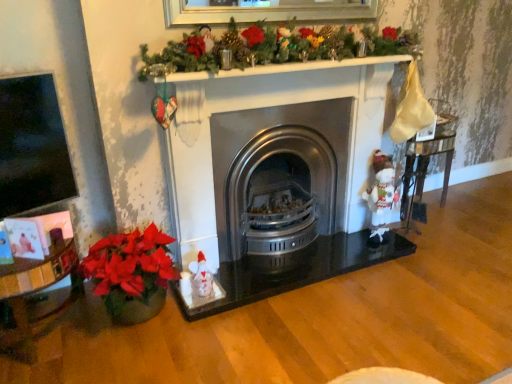
At what (x,y) coordinates should I click in order to perform the action: click on stainless steel wood burning stove at center. Please return your answer as a coordinate pair (x, y). Image resolution: width=512 pixels, height=384 pixels. Looking at the image, I should click on (279, 178).

You are a GUI agent. You are given a task and a screenshot of the screen. Output one action in this format:
    pyautogui.click(x=<x>, y=<y>)
    Task: Click on the wooden glossy table at right
    
    Given the screenshot: What is the action you would take?
    pyautogui.click(x=426, y=169)

The image size is (512, 384). I want to click on stainless steel wood burning stove at center, so click(x=279, y=178).

Do you think stainless steel wood burning stove at center is within white plush santa at right, or outside of it?

stainless steel wood burning stove at center cannot be found inside white plush santa at right.

Considering the relative sizes of stainless steel wood burning stove at center and white plush santa at right in the image provided, is stainless steel wood burning stove at center thinner than white plush santa at right?

No, stainless steel wood burning stove at center is not thinner than white plush santa at right.

Between point (313, 231) and point (374, 155), which one is positioned in front?

The point (374, 155) is closer to the camera.

Is stainless steel wood burning stove at center to the left or to the right of white plush santa at right in the image?

From the image, it's evident that stainless steel wood burning stove at center is to the left of white plush santa at right.

Does white plush santa at right have a greater width compared to stainless steel wood burning stove at center?

Incorrect, the width of white plush santa at right does not surpass that of stainless steel wood burning stove at center.

Can you confirm if white plush santa at right is positioned to the left of stainless steel wood burning stove at center?

In fact, white plush santa at right is to the right of stainless steel wood burning stove at center.

Is white plush santa at right positioned beyond the bounds of stainless steel wood burning stove at center?

Yes.

Considering the points (387, 158) and (269, 247), which point is behind, point (387, 158) or point (269, 247)?

The point (387, 158) is behind.

Between point (443, 139) and point (262, 237), which one is positioned in front?

The point (262, 237) is closer to the camera.

How different are the orientations of wooden glossy table at right and stainless steel wood burning stove at center in degrees?

0.293 degrees separate the facing orientations of wooden glossy table at right and stainless steel wood burning stove at center.

Is wooden glossy table at right taller or shorter than stainless steel wood burning stove at center?

In the image, wooden glossy table at right appears to be shorter than stainless steel wood burning stove at center.

Considering the sizes of objects wooden glossy table at right and stainless steel wood burning stove at center in the image provided, who is bigger, wooden glossy table at right or stainless steel wood burning stove at center?

Result: Bigger between the two is stainless steel wood burning stove at center.

Is point (292, 190) behind point (424, 206)?

No, it is not.

From a real-world perspective, is stainless steel wood burning stove at center physically located above or below wooden glossy table at right?

From a real-world perspective, stainless steel wood burning stove at center is physically above wooden glossy table at right.

Does stainless steel wood burning stove at center have a lesser width compared to wooden glossy table at right?

In fact, stainless steel wood burning stove at center might be wider than wooden glossy table at right.

Is stainless steel wood burning stove at center beside wooden glossy table at right?

No, stainless steel wood burning stove at center is not with wooden glossy table at right.

Locate an element on the screen. This screenshot has height=384, width=512. santa claus in front of the wooden glossy table at right is located at coordinates (380, 195).

In the image, is white plush santa at right positioned in front of or behind wooden glossy table at right?

white plush santa at right is in front of wooden glossy table at right.

From the image's perspective, would you say white plush santa at right is positioned over wooden glossy table at right?

No, from the image's perspective, white plush santa at right is not above wooden glossy table at right.

Is white plush santa at right aimed at wooden glossy table at right?

No, white plush santa at right is not aimed at wooden glossy table at right.

Is wooden glossy table at right next to white plush santa at right and touching it?

No, wooden glossy table at right is not in contact with white plush santa at right.

Does wooden glossy table at right have a greater width compared to white plush santa at right?

Yes, wooden glossy table at right is wider than white plush santa at right.

You are a GUI agent. You are given a task and a screenshot of the screen. Output one action in this format:
    pyautogui.click(x=<x>, y=<y>)
    Task: Click on the santa claus on the left side of wooden glossy table at right
    Image resolution: width=512 pixels, height=384 pixels.
    Given the screenshot: What is the action you would take?
    pyautogui.click(x=380, y=195)

You are a GUI agent. You are given a task and a screenshot of the screen. Output one action in this format:
    pyautogui.click(x=<x>, y=<y>)
    Task: Click on the wood burning stove in front of the white plush santa at right
    
    Given the screenshot: What is the action you would take?
    pyautogui.click(x=279, y=178)

Where is `santa claus below the stainless steel wood burning stove at center (from a real-world perspective)`? Image resolution: width=512 pixels, height=384 pixels. santa claus below the stainless steel wood burning stove at center (from a real-world perspective) is located at coordinates (380, 195).

Based on the photo, from the image, which object appears to be nearer to stainless steel wood burning stove at center, white plush santa at right or wooden glossy table at right?

The object closer to stainless steel wood burning stove at center is white plush santa at right.

From the picture: Which object lies further to the anchor point white plush santa at right, wooden glossy table at right or stainless steel wood burning stove at center?

Based on the image, stainless steel wood burning stove at center appears to be further to white plush santa at right.

When comparing their distances from wooden glossy table at right, does stainless steel wood burning stove at center or white plush santa at right seem closer?

white plush santa at right lies closer to wooden glossy table at right than the other object.

Consider the image. Based on their spatial positions, is stainless steel wood burning stove at center or wooden glossy table at right further from white plush santa at right?

stainless steel wood burning stove at center is positioned further to the anchor white plush santa at right.

Based on their spatial positions, is white plush santa at right or stainless steel wood burning stove at center further from wooden glossy table at right?

stainless steel wood burning stove at center is positioned further to the anchor wooden glossy table at right.

Estimate the real-world distances between objects in this image. Which object is further from stainless steel wood burning stove at center, wooden glossy table at right or white plush santa at right?

Based on the image, wooden glossy table at right appears to be further to stainless steel wood burning stove at center.

Locate an element on the screen. santa claus between stainless steel wood burning stove at center and wooden glossy table at right in the horizontal direction is located at coordinates (380, 195).